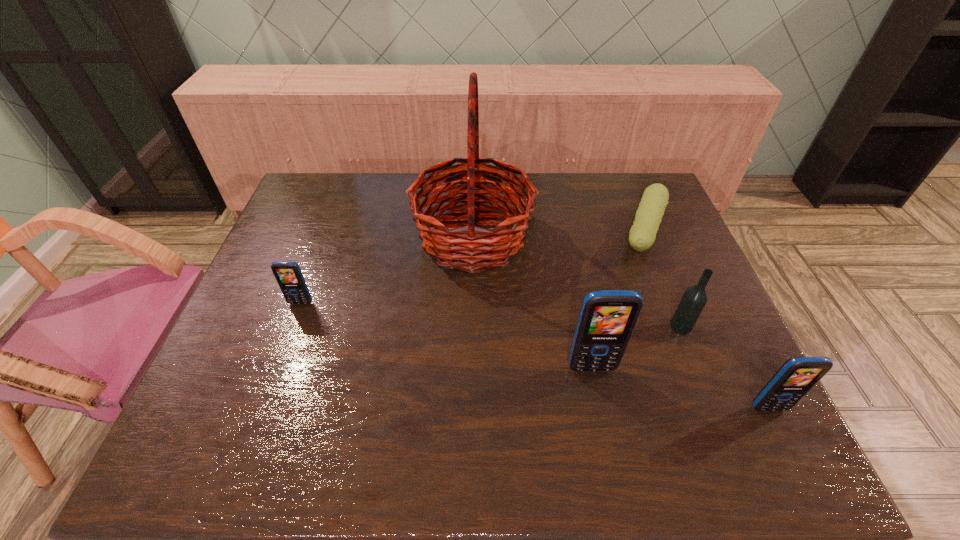
Locate an element on the screen. the fourth nearest object is located at coordinates (288, 274).

Identify the location of the leftmost object. The image size is (960, 540). (288, 274).

Locate an element on the screen. The height and width of the screenshot is (540, 960). the fifth shortest object is located at coordinates click(607, 318).

You are a GUI agent. You are given a task and a screenshot of the screen. Output one action in this format:
    pyautogui.click(x=<x>, y=<y>)
    Task: Click on the second farthest cellular telephone
    Image resolution: width=960 pixels, height=540 pixels.
    Given the screenshot: What is the action you would take?
    pyautogui.click(x=607, y=318)

Locate an element on the screen. This screenshot has height=540, width=960. the rightmost cellular telephone is located at coordinates (797, 375).

This screenshot has height=540, width=960. I want to click on the nearest object, so click(x=797, y=375).

Where is `basket`? basket is located at coordinates (467, 248).

Locate an element on the screen. the tallest object is located at coordinates (467, 248).

The image size is (960, 540). Find the location of `cucumber`. cucumber is located at coordinates (642, 235).

I want to click on vodka, so click(x=694, y=299).